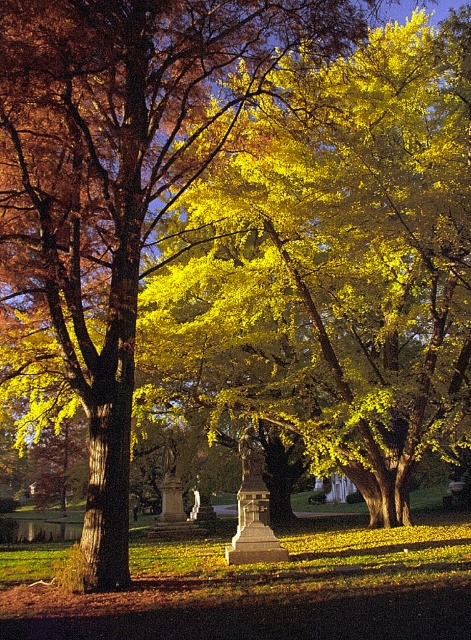
You are standing in the park and want to take a photo of both point (333, 323) and point (105, 557) in the scene. Which point is closer to your camera lens?

Point (105, 557) is closer to the camera lens because it is less further than point (333, 323).